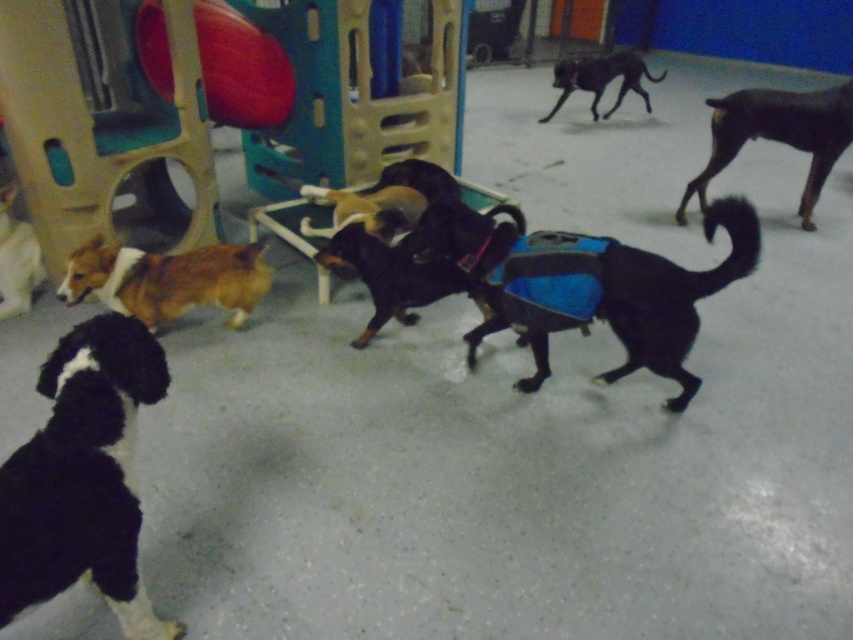
Does brown and white fur at left have a larger size compared to brown and white fur at lower left?

Indeed, brown and white fur at left has a larger size compared to brown and white fur at lower left.

Who is taller, brown and white fur at left or brown and white fur at lower left?

Standing taller between the two is brown and white fur at lower left.

Does point (125, 252) come in front of point (32, 257)?

Yes, it is.

In order to click on brown and white fur at left in this screenshot , I will do `click(167, 280)`.

Between brown and white fur at left and black smooth dog at upper right, which one is positioned higher?

black smooth dog at upper right is higher up.

Measure the distance between point [109,276] and camera.

Point [109,276] is 8.57 feet away from camera.

Locate an element on the screen. The image size is (853, 640). brown and white fur at left is located at coordinates (167, 280).

This screenshot has width=853, height=640. Describe the element at coordinates (608, 292) in the screenshot. I see `blue fabric bag at center` at that location.

At what (x,y) coordinates should I click in order to perform the action: click on blue fabric bag at center. Please return your answer as a coordinate pair (x, y). The image size is (853, 640). Looking at the image, I should click on click(x=608, y=292).